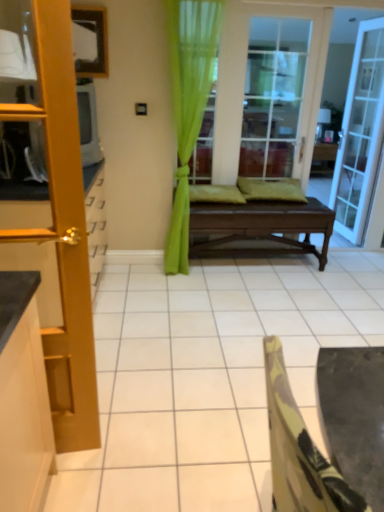
Question: Is camouflage fabric chair at lower right surrounded by dark brown wooden bench at center?

Choices:
 (A) yes
 (B) no

Answer: (B)

Question: From a real-world perspective, does dark brown wooden bench at center sit lower than camouflage fabric chair at lower right?

Choices:
 (A) no
 (B) yes

Answer: (B)

Question: Considering the relative sizes of dark brown wooden bench at center and camouflage fabric chair at lower right in the image provided, is dark brown wooden bench at center bigger than camouflage fabric chair at lower right?

Choices:
 (A) no
 (B) yes

Answer: (B)

Question: Can you confirm if dark brown wooden bench at center is taller than camouflage fabric chair at lower right?

Choices:
 (A) yes
 (B) no

Answer: (B)

Question: From the image's perspective, does dark brown wooden bench at center appear lower than camouflage fabric chair at lower right?

Choices:
 (A) no
 (B) yes

Answer: (A)

Question: From the image's perspective, is camouflage fabric chair at lower right above or below clear glass door at upper right, the 2th door from the left?

Choices:
 (A) above
 (B) below

Answer: (B)

Question: Is point (268, 375) positioned closer to the camera than point (377, 126)?

Choices:
 (A) closer
 (B) farther

Answer: (A)

Question: Is camouflage fabric chair at lower right inside or outside of clear glass door at upper right, the 2th door from the left?

Choices:
 (A) outside
 (B) inside

Answer: (A)

Question: Considering their positions, is camouflage fabric chair at lower right located in front of or behind clear glass door at upper right, the 2th door positioned from the front?

Choices:
 (A) behind
 (B) front

Answer: (B)

Question: From a real-world perspective, is dark brown wooden bench at center physically located above or below clear glass door at upper right, the first door from the back?

Choices:
 (A) below
 (B) above

Answer: (A)

Question: From the image's perspective, is dark brown wooden bench at center above or below clear glass door at upper right, the 2th door from the left?

Choices:
 (A) above
 (B) below

Answer: (B)

Question: Is point (289, 244) closer or farther from the camera than point (372, 44)?

Choices:
 (A) closer
 (B) farther

Answer: (A)

Question: In terms of height, does dark brown wooden bench at center look taller or shorter compared to clear glass door at upper right, the 2th door from the left?

Choices:
 (A) short
 (B) tall

Answer: (A)

Question: Relative to wooden door at left, the 1th door in the left-to-right sequence, is dark brown wooden bench at center in front or behind?

Choices:
 (A) behind
 (B) front

Answer: (A)

Question: From the image's perspective, is dark brown wooden bench at center above or below wooden door at left, which is the second door in right-to-left order?

Choices:
 (A) below
 (B) above

Answer: (B)